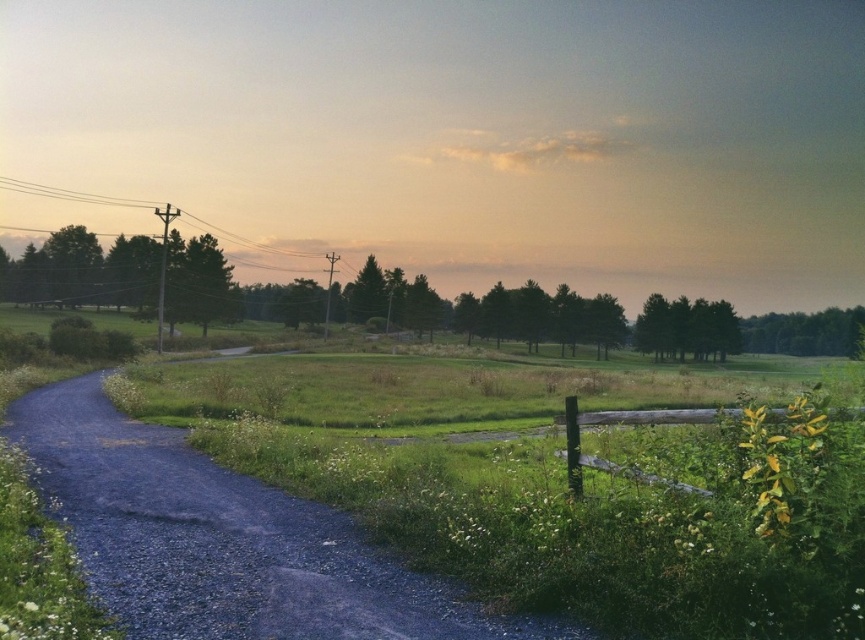
You are a hiker standing on the gravel path in the rural landscape. You notice the green leafy tree at left and the white plastic power line at upper left. Which object is taller?

The green leafy tree at left is shorter than the white plastic power line at upper left, so the white plastic power line at upper left is taller.